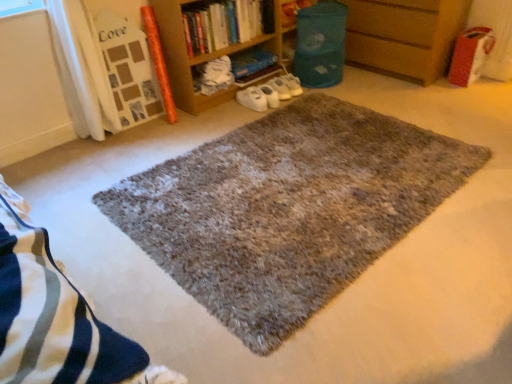
Question: Is shaggy gray rug at center completely or partially outside of hardcover book at center, the 1th book in the back-to-front sequence?

Choices:
 (A) yes
 (B) no

Answer: (A)

Question: From a real-world perspective, is shaggy gray rug at center physically above hardcover book at center, marked as the second book in a front-to-back arrangement?

Choices:
 (A) no
 (B) yes

Answer: (A)

Question: Considering the relative sizes of shaggy gray rug at center and hardcover book at center, the 1th book in the back-to-front sequence, in the image provided, is shaggy gray rug at center shorter than hardcover book at center, the 1th book in the back-to-front sequence,?

Choices:
 (A) yes
 (B) no

Answer: (A)

Question: Does shaggy gray rug at center come behind hardcover book at center, marked as the second book in a front-to-back arrangement?

Choices:
 (A) no
 (B) yes

Answer: (A)

Question: Considering the relative positions of shaggy gray rug at center and hardcover book at center, the 1th book in the back-to-front sequence, in the image provided, is shaggy gray rug at center to the right of hardcover book at center, the 1th book in the back-to-front sequence, from the viewer's perspective?

Choices:
 (A) no
 (B) yes

Answer: (B)

Question: From a real-world perspective, is hardcover book at center, marked as the second book in a front-to-back arrangement, above or below white matte shoes at center?

Choices:
 (A) above
 (B) below

Answer: (A)

Question: Considering the positions of point (240, 59) and point (249, 104), is point (240, 59) closer or farther from the camera than point (249, 104)?

Choices:
 (A) farther
 (B) closer

Answer: (A)

Question: From their relative heights in the image, would you say hardcover book at center, the 1th book in the back-to-front sequence, is taller or shorter than white matte shoes at center?

Choices:
 (A) tall
 (B) short

Answer: (B)

Question: In terms of size, does hardcover book at center, the 1th book in the back-to-front sequence, appear bigger or smaller than white matte shoes at center?

Choices:
 (A) big
 (B) small

Answer: (A)

Question: Is point (247, 87) positioned closer to the camera than point (253, 51)?

Choices:
 (A) closer
 (B) farther

Answer: (A)

Question: In terms of height, does white matte shoes at center look taller or shorter compared to hardcover book at center, the 1th book in the back-to-front sequence?

Choices:
 (A) short
 (B) tall

Answer: (B)

Question: From a real-world perspective, is white matte shoes at center above or below hardcover book at center, marked as the second book in a front-to-back arrangement?

Choices:
 (A) above
 (B) below

Answer: (B)

Question: Is white matte shoes at center spatially inside hardcover book at center, marked as the second book in a front-to-back arrangement, or outside of it?

Choices:
 (A) inside
 (B) outside

Answer: (B)

Question: From the image's perspective, is wooden at right positioned above or below hardcover book at upper center, the second book from the back?

Choices:
 (A) below
 (B) above

Answer: (B)

Question: Is wooden at right bigger or smaller than hardcover book at upper center, the second book from the back?

Choices:
 (A) small
 (B) big

Answer: (B)